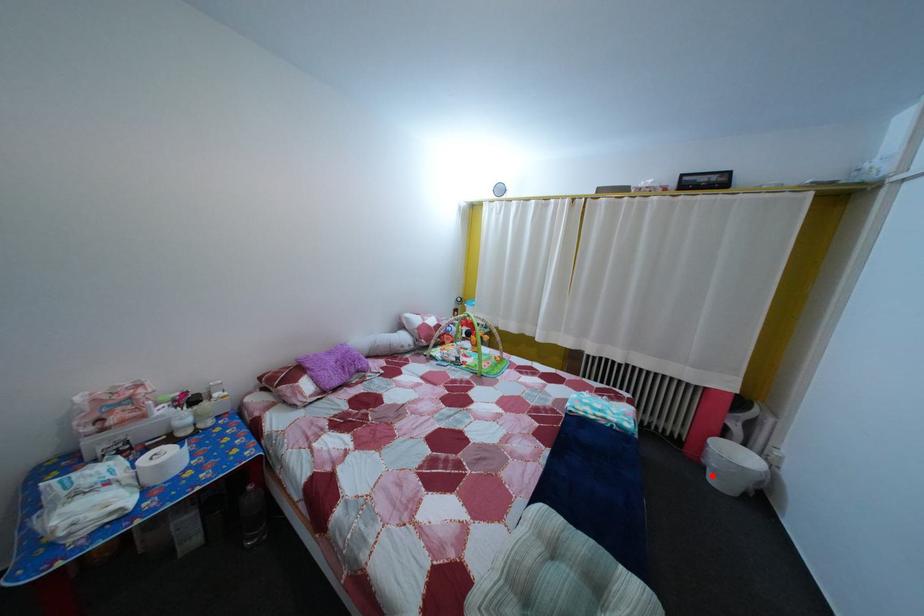
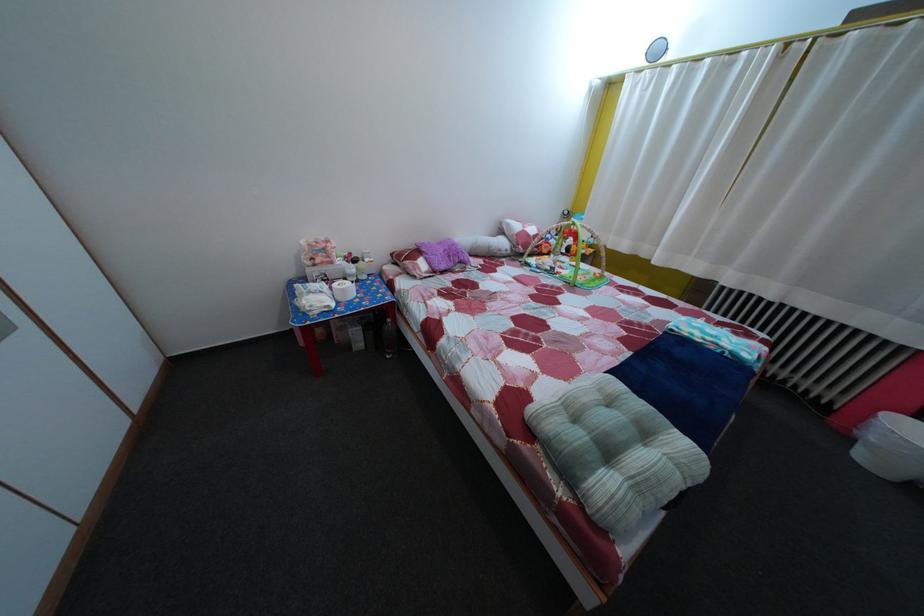
The point at the highlighted location is marked in the first image. Where is the corresponding point in the second image?

(860, 447)